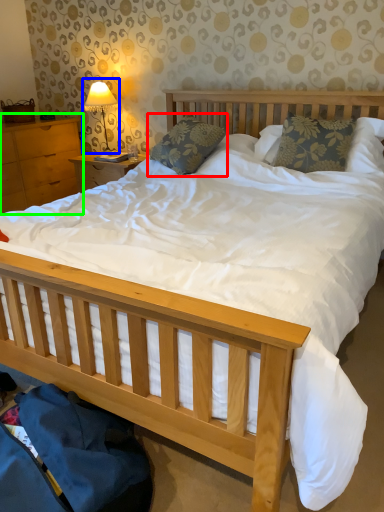
Question: Which object is the closest to the pillow (highlighted by a red box)? Choose among these: table lamp (highlighted by a blue box) or nightstand (highlighted by a green box).

Choices:
 (A) table lamp
 (B) nightstand

Answer: (A)